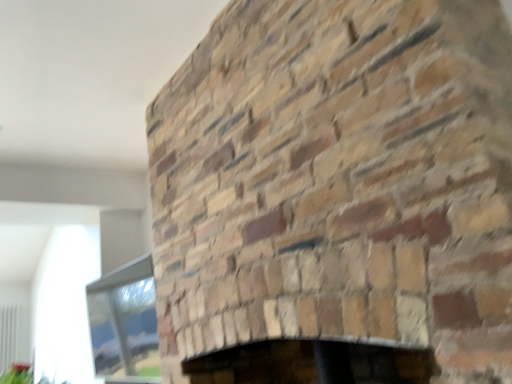
Where is `natural stone fireplace at center`? The width and height of the screenshot is (512, 384). natural stone fireplace at center is located at coordinates (337, 194).

What do you see at coordinates (337, 194) in the screenshot?
I see `natural stone fireplace at center` at bounding box center [337, 194].

The width and height of the screenshot is (512, 384). I want to click on natural stone fireplace at center, so click(x=337, y=194).